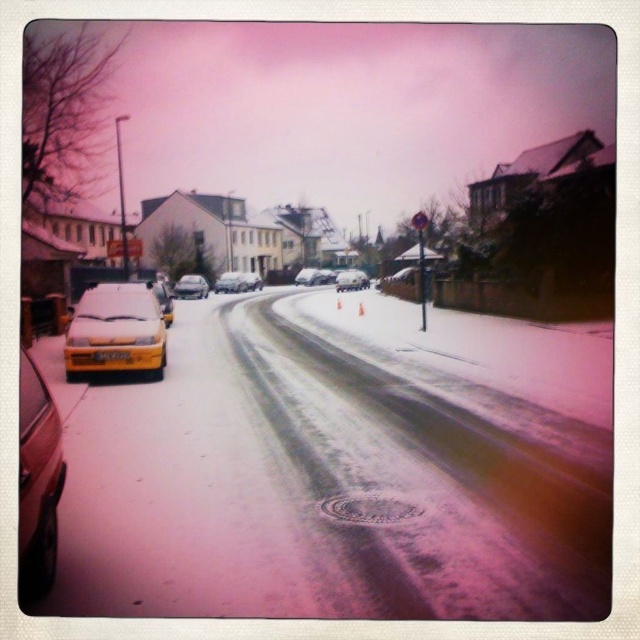
You are driving a car and want to park in the space between the metallic silver car at center and the metallic silver sedan at center. Can you safely park there?

The metallic silver car at center is closer to the viewer than the metallic silver sedan at center, so there is a gap between them that you can safely park in.

You are standing at the point with coordinates point (253, 282) and want to walk to the point with coordinates point (362, 280). Which direction should you move relative to your current position?

You should move forward because point (362, 280) is in front of point (253, 282).